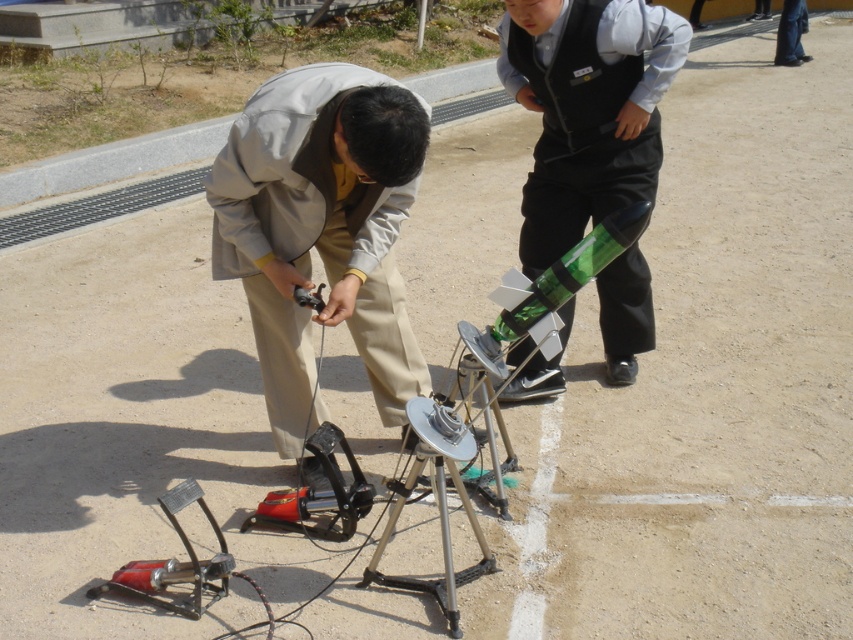
Question: Can you confirm if matte gray jacket at center is positioned above green plastic rocket at center?

Choices:
 (A) no
 (B) yes

Answer: (A)

Question: Is matte gray jacket at center thinner than green plastic rocket at center?

Choices:
 (A) yes
 (B) no

Answer: (B)

Question: Which object appears closest to the camera in this image?

Choices:
 (A) green plastic rocket at center
 (B) matte gray jacket at center

Answer: (B)

Question: Can you confirm if matte gray jacket at center is positioned to the left of green plastic rocket at center?

Choices:
 (A) yes
 (B) no

Answer: (A)